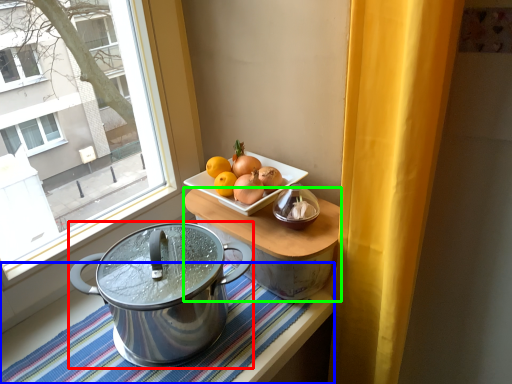
Question: Considering the real-world distances, which object is farthest from kitchen appliance (highlighted by a red box)? tablecloth (highlighted by a blue box) or table (highlighted by a green box)?

Choices:
 (A) tablecloth
 (B) table

Answer: (A)